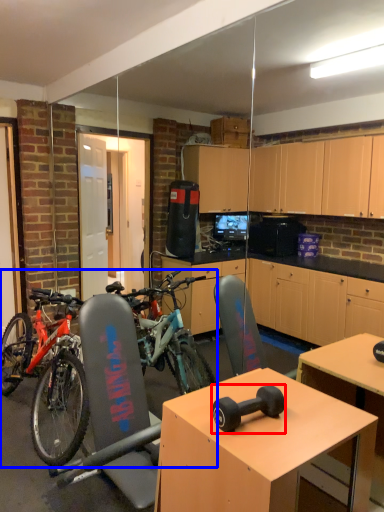
Question: Which object appears farthest to the camera in this image, dumbbell (highlighted by a red box) or bicycle (highlighted by a blue box)?

Choices:
 (A) dumbbell
 (B) bicycle

Answer: (B)